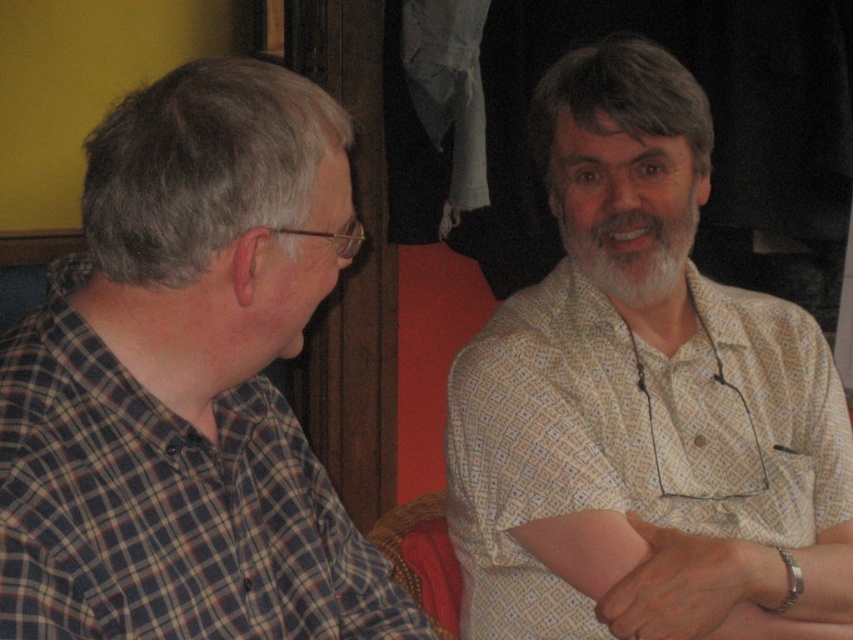
Consider the image. You are a photographer trying to capture a candid shot of the scene. You want to ensure both the plaid shirt at left and the whitehairbeard at center are visible in the frame. Based on their positions, which one is lower in the image?

The plaid shirt at left is located below whitehairbeard at center, so the plaid shirt at left is lower in the image.

You are a photographer setting up for a group photo. You need to position the white dotted shirt at upper right and the whitehairbeard at center so that both are visible in the frame. Given their sizes, which object should you place closer to the camera to ensure they appear balanced in size?

Since the white dotted shirt at upper right is larger than the whitehairbeard at center, you should place the whitehairbeard at center closer to the camera to balance their sizes in the photo.

You are standing in the room and want to walk from point A to point B. Point A is at coordinates point (306, 316) and point B is at coordinates point (786, 620). Which direction should you face to walk towards point B from point A?

To walk from point A to point B, you should face towards the upper right direction since point B is located at coordinates (786, 620) which is northeast of point A at (306, 316).